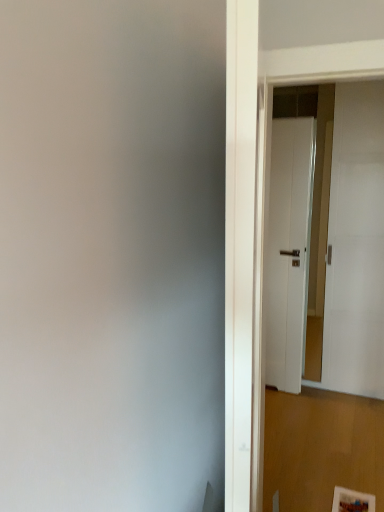
What do you see at coordinates (288, 250) in the screenshot? I see `white matte door at right, placed as the first door when sorted from left to right` at bounding box center [288, 250].

Where is `white matte door at right, placed as the first door when sorted from left to right`? Image resolution: width=384 pixels, height=512 pixels. white matte door at right, placed as the first door when sorted from left to right is located at coordinates (288, 250).

This screenshot has width=384, height=512. In order to click on white matte door at upper right, the 2th door when ordered from left to right in this screenshot , I will do `click(352, 242)`.

In order to face white matte door at upper right, the 2th door when ordered from left to right, should I rotate leftwards or rightwards?

To align with it, rotate right about 19.236°.

The height and width of the screenshot is (512, 384). What do you see at coordinates (352, 242) in the screenshot?
I see `white matte door at upper right, which is the first door from right to left` at bounding box center [352, 242].

Locate an element on the screen. The image size is (384, 512). white matte door at right, placed as the first door when sorted from left to right is located at coordinates [x=288, y=250].

Between white matte door at right, placed as the first door when sorted from left to right, and white matte door at upper right, the 2th door when ordered from left to right, which one appears on the right side from the viewer's perspective?

From the viewer's perspective, white matte door at upper right, the 2th door when ordered from left to right, appears more on the right side.

Does white matte door at right, which is the 2th door in right-to-left order, lie behind white matte door at upper right, which is the first door from right to left?

Yes, the depth of white matte door at right, which is the 2th door in right-to-left order, is greater than that of white matte door at upper right, which is the first door from right to left.

Between point (278, 362) and point (359, 92), which one is positioned behind?

The point (278, 362) is behind.

From the image's perspective, is white matte door at right, placed as the first door when sorted from left to right, located above or below white matte door at upper right, which is the first door from right to left?

Clearly, from the image's perspective, white matte door at right, placed as the first door when sorted from left to right, is below white matte door at upper right, which is the first door from right to left.

From a real-world perspective, is white matte door at right, which is the 2th door in right-to-left order, above or below white matte door at upper right, which is the first door from right to left?

white matte door at right, which is the 2th door in right-to-left order, is below white matte door at upper right, which is the first door from right to left.

Can you confirm if white matte door at right, placed as the first door when sorted from left to right, is wider than white matte door at upper right, which is the first door from right to left?

No, white matte door at right, placed as the first door when sorted from left to right, is not wider than white matte door at upper right, which is the first door from right to left.

Who is shorter, white matte door at right, placed as the first door when sorted from left to right, or white matte door at upper right, which is the first door from right to left?

Standing shorter between the two is white matte door at right, placed as the first door when sorted from left to right.

Is white matte door at right, placed as the first door when sorted from left to right, smaller than white matte door at upper right, the 2th door when ordered from left to right?

Yes, white matte door at right, placed as the first door when sorted from left to right, is smaller than white matte door at upper right, the 2th door when ordered from left to right.

Is white matte door at right, placed as the first door when sorted from left to right, inside the boundaries of white matte door at upper right, which is the first door from right to left, or outside?

white matte door at right, placed as the first door when sorted from left to right, is located beyond the bounds of white matte door at upper right, which is the first door from right to left.

Is there a large distance between white matte door at right, which is the 2th door in right-to-left order, and white matte door at upper right, which is the first door from right to left?

No.

Is white matte door at right, which is the 2th door in right-to-left order, facing towards white matte door at upper right, which is the first door from right to left?

No, white matte door at right, which is the 2th door in right-to-left order, is not aimed at white matte door at upper right, which is the first door from right to left.

I want to click on door behind the white matte door at upper right, which is the first door from right to left, so click(x=288, y=250).

Considering the positions of objects white matte door at upper right, which is the first door from right to left, and white matte door at right, which is the 2th door in right-to-left order, in the image provided, who is more to the right, white matte door at upper right, which is the first door from right to left, or white matte door at right, which is the 2th door in right-to-left order,?

white matte door at upper right, which is the first door from right to left.

Does white matte door at upper right, the 2th door when ordered from left to right, come behind white matte door at right, which is the 2th door in right-to-left order?

No, white matte door at upper right, the 2th door when ordered from left to right, is closer to the viewer.

Does point (318, 312) come farther from viewer compared to point (294, 374)?

No.

From the image's perspective, who appears lower, white matte door at upper right, the 2th door when ordered from left to right, or white matte door at right, placed as the first door when sorted from left to right?

From the image's view, white matte door at right, placed as the first door when sorted from left to right, is below.

From a real-world perspective, which object stands above the other?

In real-world perspective, white matte door at upper right, which is the first door from right to left, is above.

Considering the relative sizes of white matte door at upper right, the 2th door when ordered from left to right, and white matte door at right, placed as the first door when sorted from left to right, in the image provided, is white matte door at upper right, the 2th door when ordered from left to right, wider than white matte door at right, placed as the first door when sorted from left to right,?

Yes, white matte door at upper right, the 2th door when ordered from left to right, is wider than white matte door at right, placed as the first door when sorted from left to right.

From the picture: Can you confirm if white matte door at upper right, which is the first door from right to left, is shorter than white matte door at right, which is the 2th door in right-to-left order?

No.

Is white matte door at upper right, the 2th door when ordered from left to right, smaller than white matte door at right, placed as the first door when sorted from left to right?

No.

Is white matte door at upper right, which is the first door from right to left, inside the boundaries of white matte door at right, which is the 2th door in right-to-left order, or outside?

white matte door at upper right, which is the first door from right to left, is not inside white matte door at right, which is the 2th door in right-to-left order, it's outside.

Is white matte door at upper right, which is the first door from right to left, positioned far away from white matte door at right, which is the 2th door in right-to-left order?

white matte door at upper right, which is the first door from right to left, is near white matte door at right, which is the 2th door in right-to-left order, not far away.

Is white matte door at upper right, which is the first door from right to left, facing away from white matte door at right, which is the 2th door in right-to-left order?

No.

What's the angular difference between white matte door at upper right, which is the first door from right to left, and white matte door at right, which is the 2th door in right-to-left order,'s facing directions?

The facing directions of white matte door at upper right, which is the first door from right to left, and white matte door at right, which is the 2th door in right-to-left order, are 0.928 degrees apart.

Based on the photo, how distant is white matte door at upper right, the 2th door when ordered from left to right, from white matte door at right, placed as the first door when sorted from left to right?

They are 5.64 inches apart.

Locate an element on the screen. This screenshot has width=384, height=512. door above the white matte door at right, placed as the first door when sorted from left to right (from the image's perspective) is located at coordinates (352, 242).

At what (x,y) coordinates should I click in order to perform the action: click on door below the white matte door at upper right, the 2th door when ordered from left to right (from the image's perspective). Please return your answer as a coordinate pair (x, y). Looking at the image, I should click on (288, 250).

You are a GUI agent. You are given a task and a screenshot of the screen. Output one action in this format:
    pyautogui.click(x=<x>, y=<y>)
    Task: Click on the door that appears in front of the white matte door at right, placed as the first door when sorted from left to right
    The width and height of the screenshot is (384, 512).
    Given the screenshot: What is the action you would take?
    pyautogui.click(x=352, y=242)